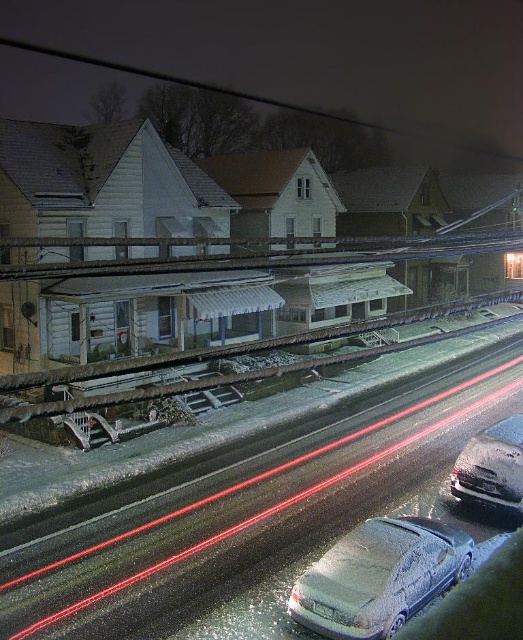
Question: Does snow-covered sedan at lower center appear under sleek silver sedan at lower right?

Choices:
 (A) no
 (B) yes

Answer: (B)

Question: Is snow-covered sedan at lower center wider than sleek silver sedan at lower right?

Choices:
 (A) no
 (B) yes

Answer: (B)

Question: Which point is farther to the camera?

Choices:
 (A) sleek silver sedan at lower right
 (B) snow-covered sedan at lower center

Answer: (A)

Question: Which point is farther to the camera?

Choices:
 (A) snow-covered sedan at lower center
 (B) sleek silver sedan at lower right

Answer: (B)

Question: Does snow-covered sedan at lower center come behind sleek silver sedan at lower right?

Choices:
 (A) no
 (B) yes

Answer: (A)